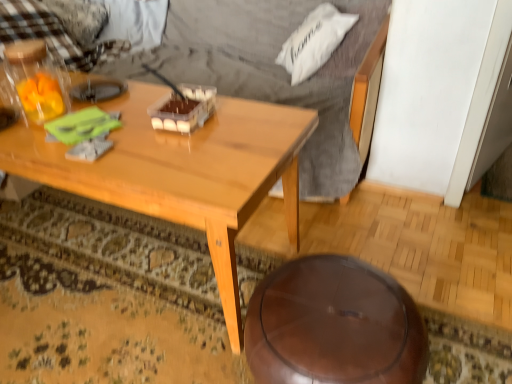
Question: Is checkered fabric pillow at upper left, placed as the 2th pillow when sorted from front to back, thinner than light brown wood coffee table at center?

Choices:
 (A) no
 (B) yes

Answer: (B)

Question: Could you tell me if checkered fabric pillow at upper left, which is the second pillow from right to left, is turned towards light brown wood coffee table at center?

Choices:
 (A) yes
 (B) no

Answer: (B)

Question: Considering the relative sizes of checkered fabric pillow at upper left, which is the second pillow from right to left, and light brown wood coffee table at center in the image provided, is checkered fabric pillow at upper left, which is the second pillow from right to left, wider than light brown wood coffee table at center?

Choices:
 (A) yes
 (B) no

Answer: (B)

Question: Can you confirm if checkered fabric pillow at upper left, placed as the 2th pillow when sorted from front to back, is positioned to the left of light brown wood coffee table at center?

Choices:
 (A) no
 (B) yes

Answer: (B)

Question: Is checkered fabric pillow at upper left, which is the second pillow from right to left, positioned with its back to light brown wood coffee table at center?

Choices:
 (A) yes
 (B) no

Answer: (B)

Question: From the image's perspective, is white soft pillow at upper right, positioned as the 2th pillow in back-to-front order, positioned above or below shiny brown stool at lower center?

Choices:
 (A) above
 (B) below

Answer: (A)

Question: Considering the positions of point (351, 21) and point (247, 349), is point (351, 21) closer or farther from the camera than point (247, 349)?

Choices:
 (A) farther
 (B) closer

Answer: (A)

Question: Is white soft pillow at upper right, which is counted as the first pillow, starting from the front, spatially inside shiny brown stool at lower center, or outside of it?

Choices:
 (A) outside
 (B) inside

Answer: (A)

Question: Relative to shiny brown stool at lower center, is white soft pillow at upper right, the second pillow in the left-to-right sequence, in front or behind?

Choices:
 (A) front
 (B) behind

Answer: (B)

Question: Does point (162, 122) appear closer or farther from the camera than point (79, 44)?

Choices:
 (A) farther
 (B) closer

Answer: (B)

Question: Is translucent plastic container at center spatially inside checkered fabric pillow at upper left, acting as the first pillow starting from the left, or outside of it?

Choices:
 (A) inside
 (B) outside

Answer: (B)

Question: From their relative heights in the image, would you say translucent plastic container at center is taller or shorter than checkered fabric pillow at upper left, the 1th pillow when ordered from back to front?

Choices:
 (A) tall
 (B) short

Answer: (B)

Question: From a real-world perspective, is translucent plastic container at center positioned above or below checkered fabric pillow at upper left, which is the second pillow from right to left?

Choices:
 (A) below
 (B) above

Answer: (B)

Question: Relative to light brown wood coffee table at center, is translucent plastic container at center in front or behind?

Choices:
 (A) front
 (B) behind

Answer: (B)

Question: Visually, is translucent plastic container at center positioned to the left or to the right of light brown wood coffee table at center?

Choices:
 (A) left
 (B) right

Answer: (B)